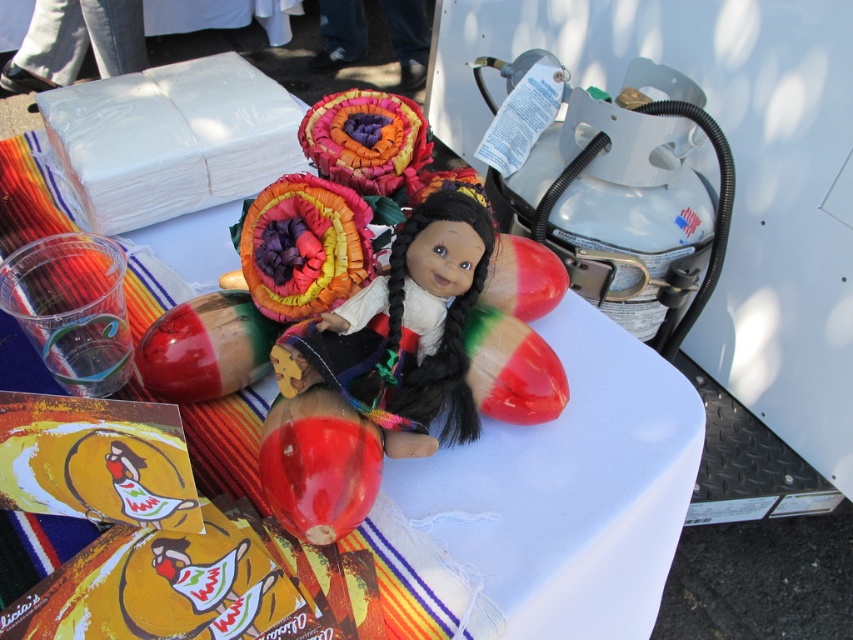
Question: Does white glossy table at center appear on the left side of matte plastic doll at center?

Choices:
 (A) no
 (B) yes

Answer: (B)

Question: Where is white glossy table at center located in relation to matte plastic doll at center in the image?

Choices:
 (A) right
 (B) left

Answer: (B)

Question: Among these points, which one is farthest from the camera?

Choices:
 (A) (407, 291)
 (B) (640, 429)

Answer: (B)

Question: From the image, what is the correct spatial relationship of white glossy table at center in relation to matte plastic doll at center?

Choices:
 (A) right
 (B) left

Answer: (B)